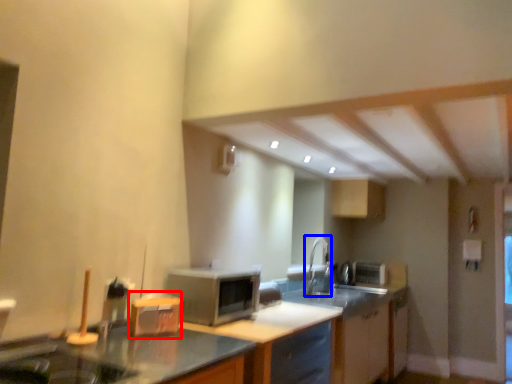
Question: Which of the following is the farthest to the observer, appliance (highlighted by a red box) or faucet (highlighted by a blue box)?

Choices:
 (A) appliance
 (B) faucet

Answer: (B)